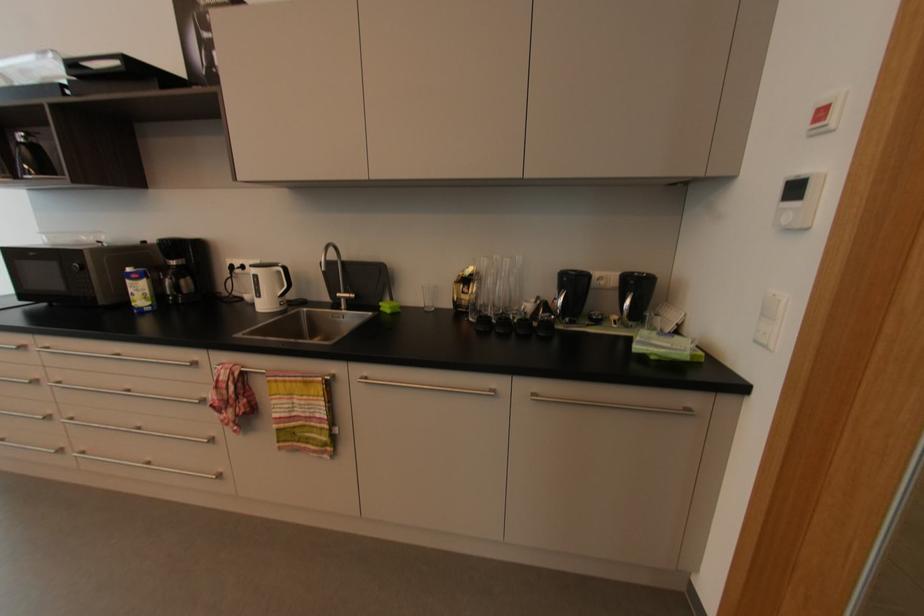
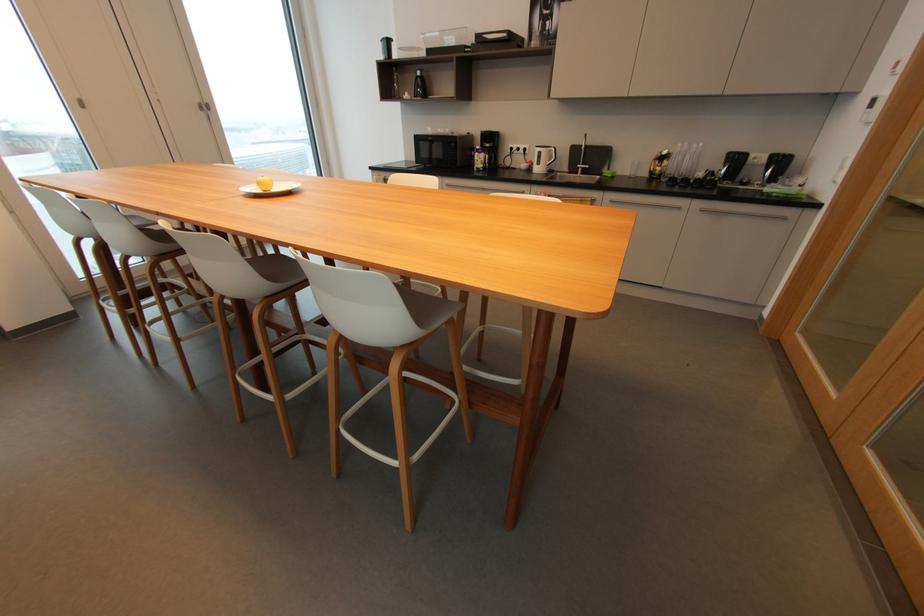
Locate, in the second image, the point that corresponds to [476,285] in the first image.

(669, 161)